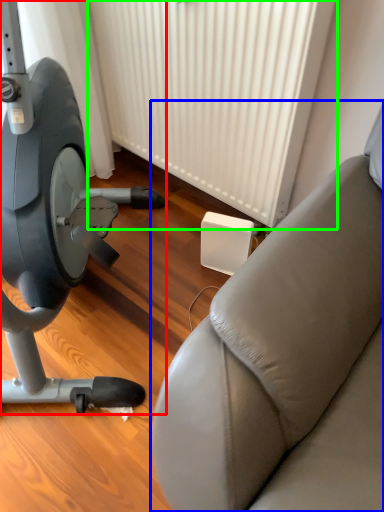
Question: Considering the real-world distances, which object is farthest from stationary bicycle (highlighted by a red box)? studio couch (highlighted by a blue box) or radiator (highlighted by a green box)?

Choices:
 (A) studio couch
 (B) radiator

Answer: (A)